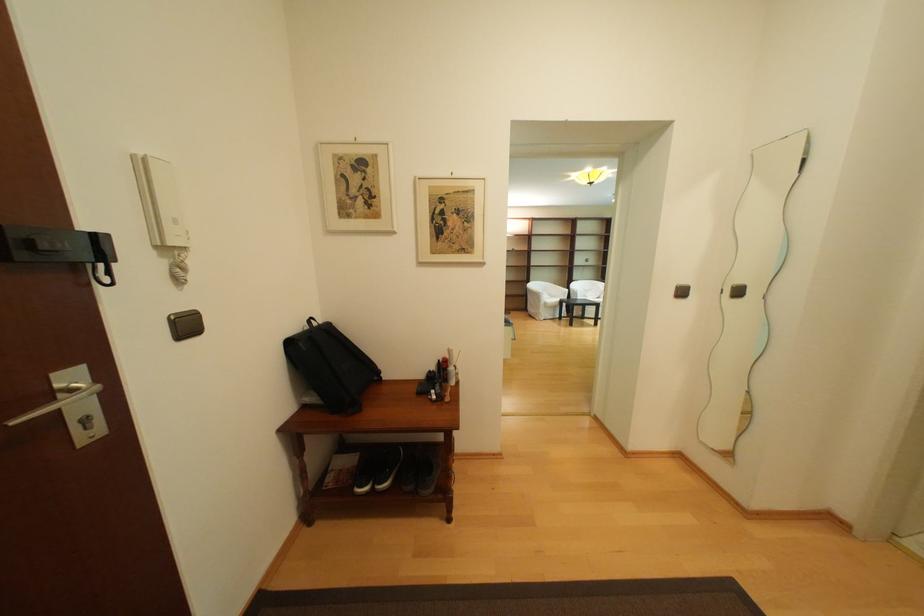
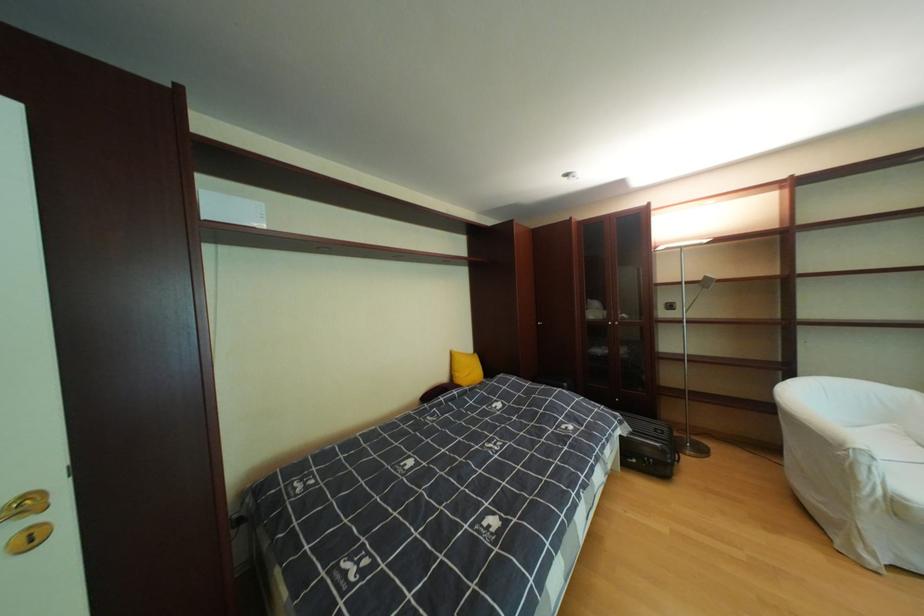
The point at (556, 305) is marked in the first image. Where is the corresponding point in the second image?

(908, 506)